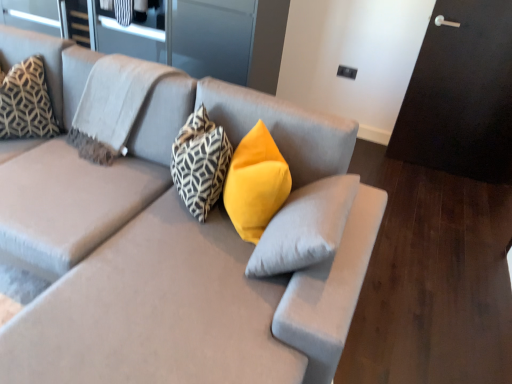
Question: Could you tell me if geometric-patterned fabric pillow at upper left, the 4th pillow viewed from the right, is facing geometric-patterned fabric pillow at center, which is the second pillow in right-to-left order?

Choices:
 (A) no
 (B) yes

Answer: (A)

Question: Is the position of geometric-patterned fabric pillow at upper left, which is the 1th pillow from left to right, more distant than that of geometric-patterned fabric pillow at center, which is the second pillow in right-to-left order?

Choices:
 (A) yes
 (B) no

Answer: (A)

Question: Considering the relative sizes of geometric-patterned fabric pillow at upper left, which is the 1th pillow from left to right, and geometric-patterned fabric pillow at center, acting as the 3th pillow starting from the left, in the image provided, is geometric-patterned fabric pillow at upper left, which is the 1th pillow from left to right, bigger than geometric-patterned fabric pillow at center, acting as the 3th pillow starting from the left,?

Choices:
 (A) no
 (B) yes

Answer: (B)

Question: From a real-world perspective, does geometric-patterned fabric pillow at upper left, the 4th pillow viewed from the right, sit lower than geometric-patterned fabric pillow at center, acting as the 3th pillow starting from the left?

Choices:
 (A) no
 (B) yes

Answer: (B)

Question: Considering the relative sizes of geometric-patterned fabric pillow at upper left, the 4th pillow viewed from the right, and geometric-patterned fabric pillow at center, which is the second pillow in right-to-left order, in the image provided, is geometric-patterned fabric pillow at upper left, the 4th pillow viewed from the right, shorter than geometric-patterned fabric pillow at center, which is the second pillow in right-to-left order,?

Choices:
 (A) yes
 (B) no

Answer: (B)

Question: Is geometric-patterned fabric pillow at upper left, which is the 1th pillow from left to right, at the left side of geometric-patterned fabric pillow at center, acting as the 3th pillow starting from the left?

Choices:
 (A) yes
 (B) no

Answer: (A)

Question: Is geometric-patterned fabric pillow at center, acting as the 3th pillow starting from the left, to the right of geometric-patterned fabric pillow at upper left, the 4th pillow viewed from the right, from the viewer's perspective?

Choices:
 (A) no
 (B) yes

Answer: (B)

Question: Does geometric-patterned fabric pillow at center, which is the second pillow in right-to-left order, come in front of geometric-patterned fabric pillow at upper left, the 4th pillow viewed from the right?

Choices:
 (A) no
 (B) yes

Answer: (B)

Question: Considering the relative sizes of geometric-patterned fabric pillow at center, which is the second pillow in right-to-left order, and geometric-patterned fabric pillow at upper left, which is the 1th pillow from left to right, in the image provided, is geometric-patterned fabric pillow at center, which is the second pillow in right-to-left order, shorter than geometric-patterned fabric pillow at upper left, which is the 1th pillow from left to right,?

Choices:
 (A) no
 (B) yes

Answer: (B)

Question: Is geometric-patterned fabric pillow at center, acting as the 3th pillow starting from the left, aimed at geometric-patterned fabric pillow at upper left, which is the 1th pillow from left to right?

Choices:
 (A) no
 (B) yes

Answer: (A)

Question: From a real-world perspective, is geometric-patterned fabric pillow at center, acting as the 3th pillow starting from the left, below geometric-patterned fabric pillow at upper left, which is the 1th pillow from left to right?

Choices:
 (A) no
 (B) yes

Answer: (A)

Question: From a real-world perspective, does geometric-patterned fabric pillow at center, which is the second pillow in right-to-left order, stand above geometric-patterned fabric pillow at upper left, the 4th pillow viewed from the right?

Choices:
 (A) no
 (B) yes

Answer: (B)

Question: Is matte gray couch at center positioned behind geometric-patterned fabric pillow at upper left, the 4th pillow viewed from the right?

Choices:
 (A) no
 (B) yes

Answer: (A)